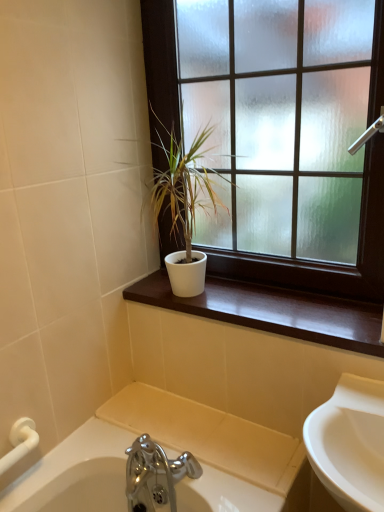
Locate an element on the screen. The image size is (384, 512). vacant space underneath white matte window at upper center (from a real-world perspective) is located at coordinates (299, 300).